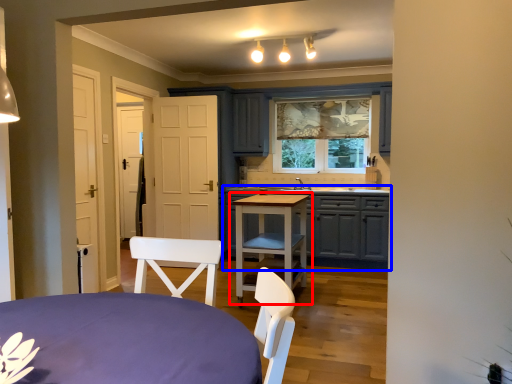
Question: Among these objects, which one is farthest to the camera, table (highlighted by a red box) or cabinetry (highlighted by a blue box)?

Choices:
 (A) table
 (B) cabinetry

Answer: (B)